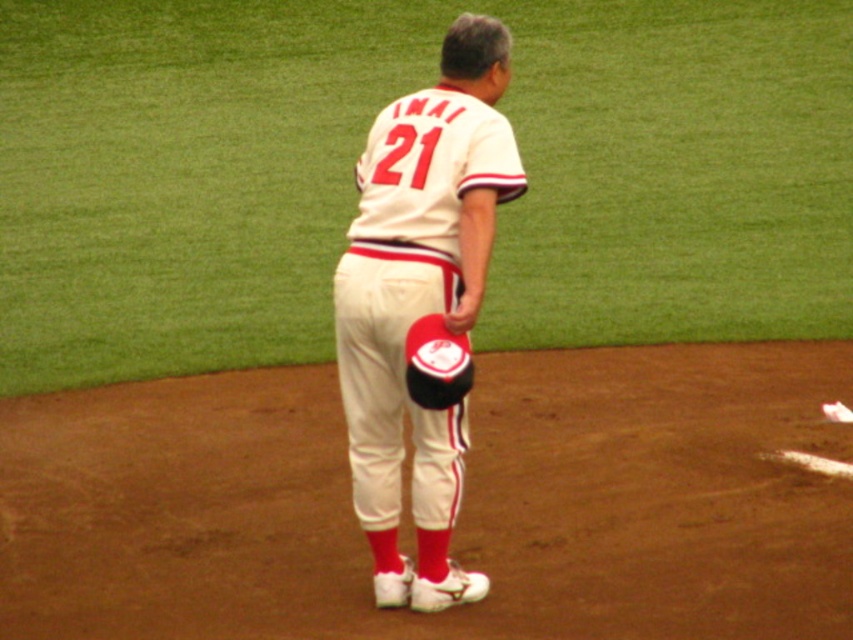
Who is positioned more to the right, white matte baseball uniform at center or black leather glove at center?

From the viewer's perspective, black leather glove at center appears more on the right side.

Is white matte baseball uniform at center bigger than black leather glove at center?

Correct, white matte baseball uniform at center is larger in size than black leather glove at center.

Does point (462, 307) come behind point (436, 387)?

Yes, it is.

At what (x,y) coordinates should I click in order to perform the action: click on white matte baseball uniform at center. Please return your answer as a coordinate pair (x, y). Image resolution: width=853 pixels, height=640 pixels. Looking at the image, I should click on (421, 300).